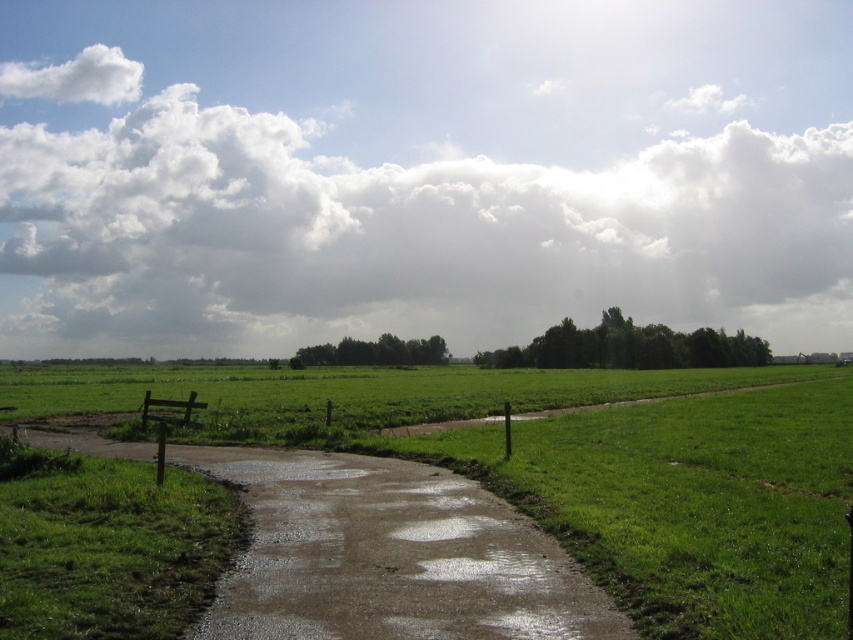
Question: Which is farther from the green grassy path at center?

Choices:
 (A) muddy concrete path at center
 (B) white fluffy cloud at upper center

Answer: (B)

Question: Where is muddy concrete path at center located in relation to green grassy path at center in the image?

Choices:
 (A) right
 (B) left

Answer: (B)

Question: Among these points, which one is farthest from the camera?

Choices:
 (A) (532, 280)
 (B) (549, 410)
 (C) (355, 456)

Answer: (A)

Question: Which point is farther to the camera?

Choices:
 (A) (228, 342)
 (B) (84, 433)
 (C) (570, 412)

Answer: (A)

Question: Does white fluffy cloud at upper center appear on the right side of green grassy path at center?

Choices:
 (A) no
 (B) yes

Answer: (A)

Question: Can you confirm if white fluffy cloud at upper center is smaller than muddy concrete path at center?

Choices:
 (A) yes
 (B) no

Answer: (B)